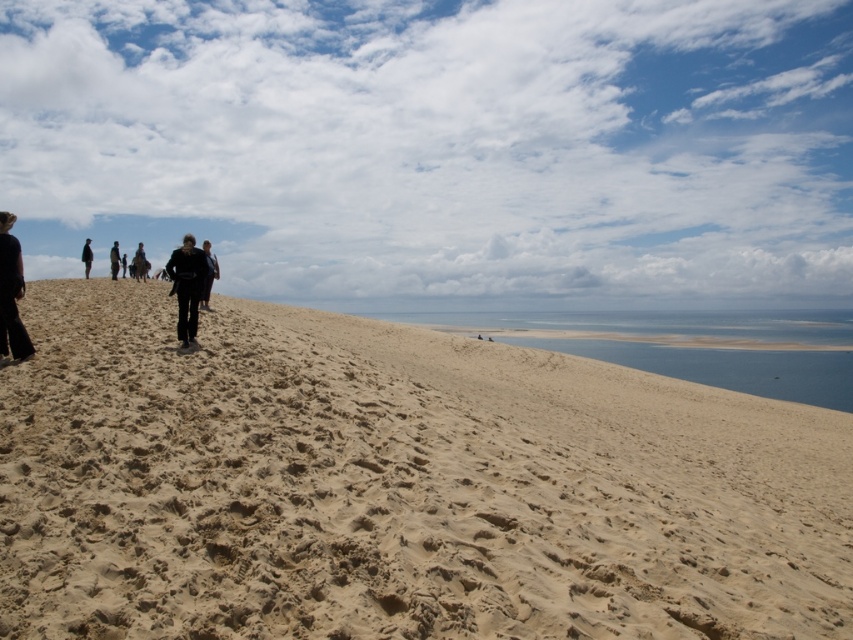
You are standing at the base of the dune and see the black matte jacket at center and the black leather jacket at upper center. Which jacket is closer to you?

The black matte jacket at center is closer to you because it is positioned lower on the dune compared to the black leather jacket at upper center, which is higher up and farther away.